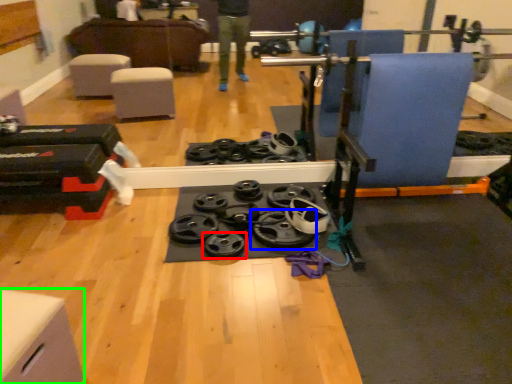
Question: Based on their relative distances, which object is nearer to wheel (highlighted by a red box)? Choose from wheel (highlighted by a blue box) and furniture (highlighted by a green box).

Choices:
 (A) wheel
 (B) furniture

Answer: (A)